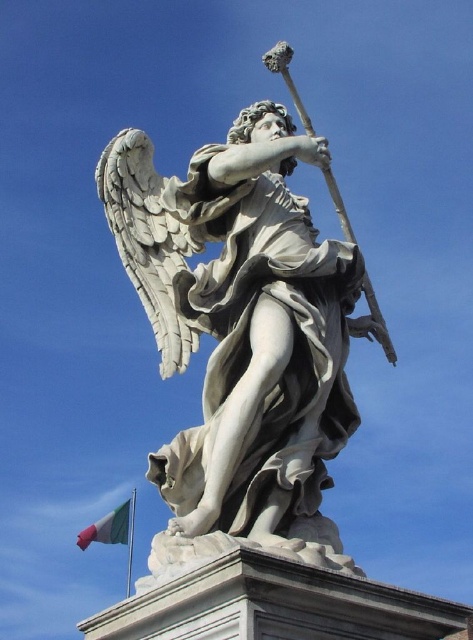
Does white marble statue at center lie in front of green fabric flag at lower left?

Yes, it is in front of green fabric flag at lower left.

Can you confirm if white marble statue at center is taller than green fabric flag at lower left?

Correct, white marble statue at center is much taller as green fabric flag at lower left.

Which is in front, point (347, 406) or point (120, 509)?

Point (347, 406)

At what (x,y) coordinates should I click in order to perform the action: click on white marble statue at center. Please return your answer as a coordinate pair (x, y). The image size is (473, 640). Looking at the image, I should click on pos(245,332).